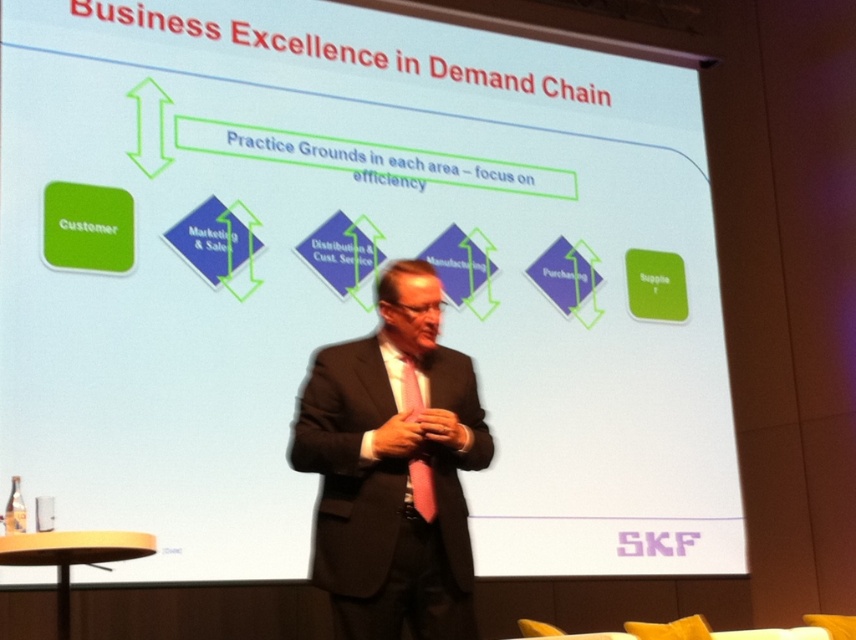
You are standing in front of a presentation slide titled Business Excellence in Demand Chain. You notice a matte black suit at center. If you want to take a closer look at the slide details, would you need to move forward or backward?

The matte black suit at center is 10.47 feet away from the camera, so to get a closer look at the slide details, you should move forward towards the matte black suit at center.

You are an assistant at a business presentation. You need to place a matte black suit at center on the slide. According to the slide layout, where should you position it?

The matte black suit at center should be placed at point coordinates (393,467) as specified in the slide layout.

You are a professional tailor preparing to alter a matte black suit at center and a pink satin tie at center for a client. The client mentioned they want to ensure the suit and tie are proportionate in length. Given the distance between them is 7.49 inches, can you determine if their lengths are suitable for a coordinated look?

The matte black suit at center is 7.49 inches from the pink satin tie at center. However, the distance between them does not directly indicate their individual lengths. To ensure proportionality, you should measure each item separately to confirm they meet the desired length requirements for a coordinated look.